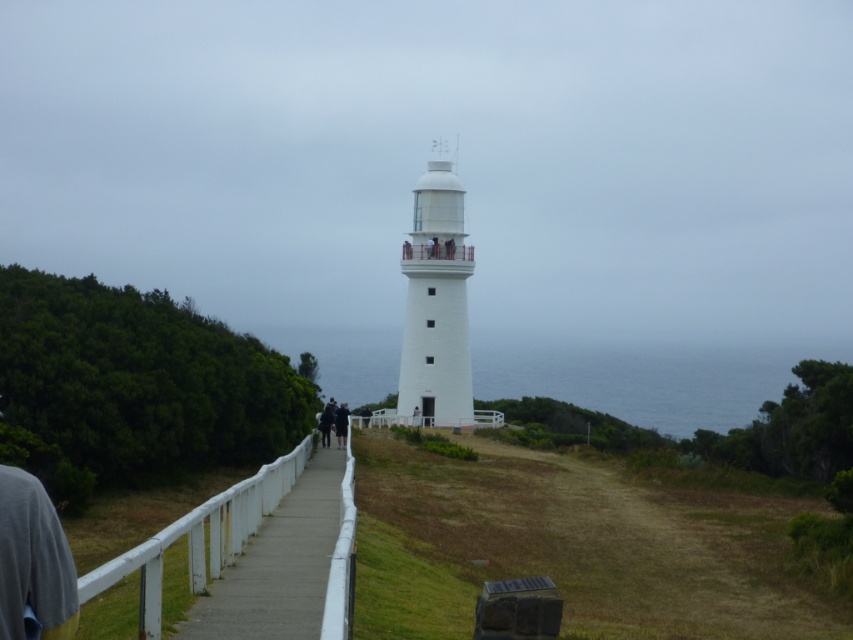
Does white wooden path at center have a lesser height compared to white smooth tower at center?

Yes.

Between point (271, 634) and point (451, 188), which one is positioned in front?

Point (271, 634)

Between point (320, 476) and point (428, 253), which one is positioned behind?

The point (428, 253) is more distant.

This screenshot has height=640, width=853. Identify the location of white wooden path at center. (288, 564).

Locate an element on the screen. Image resolution: width=853 pixels, height=640 pixels. white smooth tower at center is located at coordinates (436, 304).

Does white smooth tower at center have a smaller size compared to dark gray fabric jacket at center?

Indeed, white smooth tower at center has a smaller size compared to dark gray fabric jacket at center.

Does point (431, 356) come behind point (344, 412)?

That is True.

The height and width of the screenshot is (640, 853). In order to click on white smooth tower at center in this screenshot , I will do click(x=436, y=304).

Who is positioned more to the left, white wooden path at center or dark gray fabric jacket at center?

From the viewer's perspective, dark gray fabric jacket at center appears more on the left side.

Who is lower down, white wooden path at center or dark gray fabric jacket at center?

dark gray fabric jacket at center is lower down.

Between point (320, 636) and point (337, 420), which one is positioned behind?

The point (337, 420) is more distant.

Locate an element on the screen. The height and width of the screenshot is (640, 853). white wooden path at center is located at coordinates (288, 564).